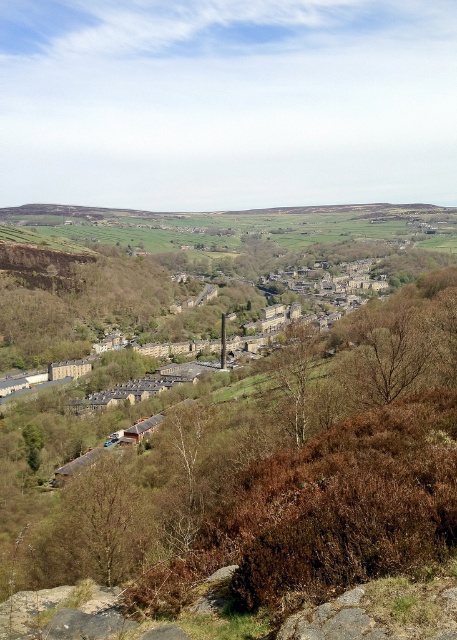
Question: Which object appears farthest from the camera in this image?

Choices:
 (A) brown textured tree at lower left
 (B) bare branches at center

Answer: (B)

Question: Is brown textured tree at lower left to the right of brown textured tree at center from the viewer's perspective?

Choices:
 (A) no
 (B) yes

Answer: (A)

Question: Which object appears farthest from the camera in this image?

Choices:
 (A) brown textured tree at lower left
 (B) bare branches at center
 (C) brown textured tree at center

Answer: (B)

Question: From the image, what is the correct spatial relationship of brown textured tree at lower left in relation to brown textured tree at center?

Choices:
 (A) right
 (B) left

Answer: (B)

Question: Which point is closer to the camera?

Choices:
 (A) bare branches at center
 (B) brown textured tree at lower left
 (C) brown textured tree at center

Answer: (B)

Question: Can you confirm if brown textured tree at lower left is positioned below bare branches at center?

Choices:
 (A) yes
 (B) no

Answer: (A)